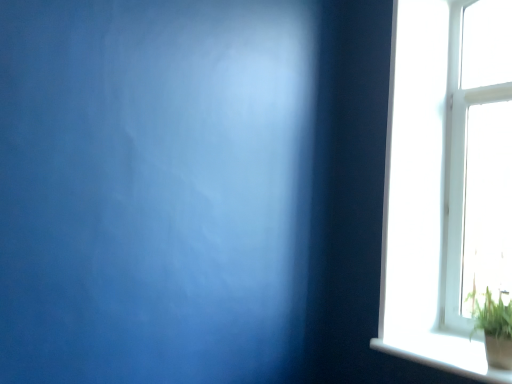
Question: Considering their positions, is green leafy plant at bottom right located in front of or behind white glossy window sill at lower right?

Choices:
 (A) front
 (B) behind

Answer: (B)

Question: Looking at their shapes, would you say green leafy plant at bottom right is wider or thinner than white glossy window sill at lower right?

Choices:
 (A) thin
 (B) wide

Answer: (A)

Question: From a real-world perspective, is green leafy plant at bottom right above or below white glossy window sill at lower right?

Choices:
 (A) below
 (B) above

Answer: (B)

Question: Is white glossy window sill at lower right inside the boundaries of green leafy plant at bottom right, or outside?

Choices:
 (A) inside
 (B) outside

Answer: (B)

Question: From the image's perspective, is white glossy window sill at lower right above or below green leafy plant at bottom right?

Choices:
 (A) above
 (B) below

Answer: (B)

Question: Considering the relative positions of white glossy window sill at lower right and green leafy plant at bottom right in the image provided, is white glossy window sill at lower right to the left or to the right of green leafy plant at bottom right?

Choices:
 (A) right
 (B) left

Answer: (B)

Question: Looking at the image, does white glossy window sill at lower right seem bigger or smaller compared to green leafy plant at bottom right?

Choices:
 (A) small
 (B) big

Answer: (A)